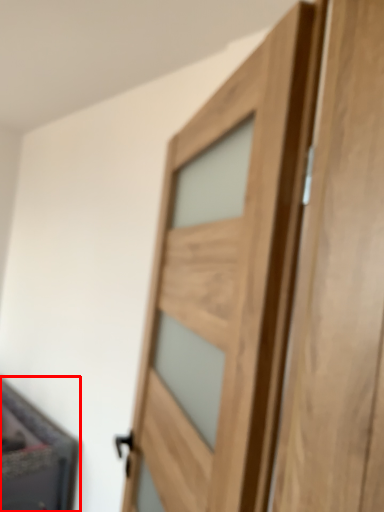
Question: Observing the image, what is the correct spatial positioning of cabinetry (annotated by the red box) in reference to door?

Choices:
 (A) right
 (B) left

Answer: (B)